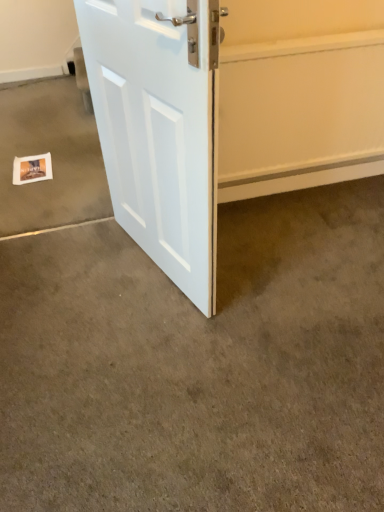
Question: Is white paper postcard at lower left taller or shorter than white paper at lower left, the 2th concrete in the front-to-back sequence?

Choices:
 (A) tall
 (B) short

Answer: (B)

Question: Is white paper postcard at lower left to the left or to the right of white paper at lower left, acting as the 1th concrete starting from the back, in the image?

Choices:
 (A) right
 (B) left

Answer: (A)

Question: Which object is positioned closest to the white paper postcard at lower left?

Choices:
 (A) white smooth door at upper center
 (B) smooth carpet at center, which ranks as the 1th concrete in front-to-back order
 (C) white paper at lower left, the 2th concrete in the front-to-back sequence
 (D) white painted wood door at center

Answer: (C)

Question: Which object is the farthest from the white paper postcard at lower left?

Choices:
 (A) white paper at lower left, the 2th concrete in the front-to-back sequence
 (B) white smooth door at upper center
 (C) white painted wood door at center
 (D) smooth carpet at center, positioned as the second concrete in back-to-front order

Answer: (B)